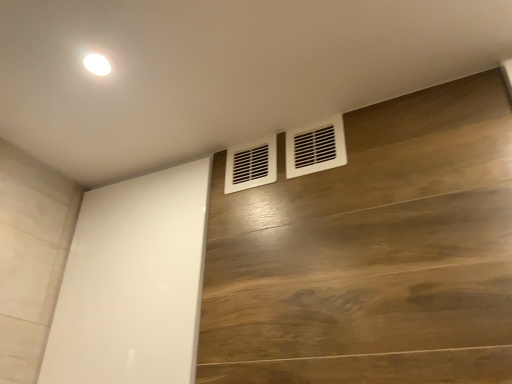
What is the approximate height of white glossy screen door at center?

white glossy screen door at center is 26.96 inches in height.

Describe the element at coordinates (251, 165) in the screenshot. This screenshot has height=384, width=512. I see `white matte vent at center, the second air conditioning viewed from the right` at that location.

Locate an element on the screen. The height and width of the screenshot is (384, 512). white glossy screen door at center is located at coordinates (133, 282).

Which object is closer to the camera, white glossy screen door at center or white plastic vent at upper right, which is counted as the second air conditioning, starting from the left?

white glossy screen door at center is more forward.

Could you measure the distance between white glossy screen door at center and white plastic vent at upper right, the first air conditioning when ordered from right to left?

The distance of white glossy screen door at center from white plastic vent at upper right, the first air conditioning when ordered from right to left, is 20.04 inches.

You are a GUI agent. You are given a task and a screenshot of the screen. Output one action in this format:
    pyautogui.click(x=<x>, y=<y>)
    Task: Click on the 1st air conditioning located above the white glossy screen door at center (from a real-world perspective)
    
    Given the screenshot: What is the action you would take?
    pyautogui.click(x=315, y=147)

Considering the sizes of objects white matte vent at center, arranged as the first air conditioning when viewed from the left, and white glossy screen door at center in the image provided, who is taller, white matte vent at center, arranged as the first air conditioning when viewed from the left, or white glossy screen door at center?

white glossy screen door at center.

How different are the orientations of white matte vent at center, arranged as the first air conditioning when viewed from the left, and white glossy screen door at center in degrees?

1.95 degrees.

Is the depth of white matte vent at center, the second air conditioning viewed from the right, less than that of white glossy screen door at center?

No, it is behind white glossy screen door at center.

Is point (338, 130) less distant than point (226, 169)?

Yes, point (338, 130) is in front of point (226, 169).

Is white plastic vent at upper right, the first air conditioning when ordered from right to left, closer to the viewer compared to white matte vent at center, the second air conditioning viewed from the right?

That is True.

Looking at their sizes, would you say white plastic vent at upper right, which is counted as the second air conditioning, starting from the left, is wider or thinner than white matte vent at center, the second air conditioning viewed from the right?

Clearly, white plastic vent at upper right, which is counted as the second air conditioning, starting from the left, has more width compared to white matte vent at center, the second air conditioning viewed from the right.

How many degrees apart are the facing directions of white plastic vent at upper right, the first air conditioning when ordered from right to left, and white matte vent at center, arranged as the first air conditioning when viewed from the left?

white plastic vent at upper right, the first air conditioning when ordered from right to left, and white matte vent at center, arranged as the first air conditioning when viewed from the left, are facing 0.00562 degrees away from each other.

Is white matte vent at center, the second air conditioning viewed from the right, outside of white plastic vent at upper right, which is counted as the second air conditioning, starting from the left?

Yes, white matte vent at center, the second air conditioning viewed from the right, is located beyond the bounds of white plastic vent at upper right, which is counted as the second air conditioning, starting from the left.

Is white matte vent at center, the second air conditioning viewed from the right, with white plastic vent at upper right, the first air conditioning when ordered from right to left?

white matte vent at center, the second air conditioning viewed from the right, and white plastic vent at upper right, the first air conditioning when ordered from right to left, are clearly separated.

Who is bigger, white matte vent at center, the second air conditioning viewed from the right, or white plastic vent at upper right, which is counted as the second air conditioning, starting from the left?

Bigger between the two is white matte vent at center, the second air conditioning viewed from the right.

Locate an element on the screen. This screenshot has width=512, height=384. air conditioning that is under the white matte vent at center, the second air conditioning viewed from the right (from a real-world perspective) is located at coordinates (315, 147).

The image size is (512, 384). Find the location of `screen door below the white matte vent at center, the second air conditioning viewed from the right (from a real-world perspective)`. screen door below the white matte vent at center, the second air conditioning viewed from the right (from a real-world perspective) is located at coordinates (133, 282).

Between white glossy screen door at center and white matte vent at center, arranged as the first air conditioning when viewed from the left, which one has larger size?

white glossy screen door at center is bigger.

Relative to white matte vent at center, arranged as the first air conditioning when viewed from the left, is white glossy screen door at center in front or behind?

In the image, white glossy screen door at center appears in front of white matte vent at center, arranged as the first air conditioning when viewed from the left.

Considering the sizes of objects white glossy screen door at center and white matte vent at center, arranged as the first air conditioning when viewed from the left, in the image provided, who is thinner, white glossy screen door at center or white matte vent at center, arranged as the first air conditioning when viewed from the left,?

Thinner between the two is white matte vent at center, arranged as the first air conditioning when viewed from the left.

Is white plastic vent at upper right, which is counted as the second air conditioning, starting from the left, not inside white glossy screen door at center?

Indeed, white plastic vent at upper right, which is counted as the second air conditioning, starting from the left, is completely outside white glossy screen door at center.

In the scene shown: Does white plastic vent at upper right, which is counted as the second air conditioning, starting from the left, have a lesser height compared to white glossy screen door at center?

Yes, white plastic vent at upper right, which is counted as the second air conditioning, starting from the left, is shorter than white glossy screen door at center.

Is white plastic vent at upper right, which is counted as the second air conditioning, starting from the left, oriented towards white glossy screen door at center?

No.

From the image's perspective, which is above, white plastic vent at upper right, which is counted as the second air conditioning, starting from the left, or white glossy screen door at center?

white plastic vent at upper right, which is counted as the second air conditioning, starting from the left, from the image's perspective.

Find the location of a particular element. The image size is (512, 384). screen door in front of the white plastic vent at upper right, which is counted as the second air conditioning, starting from the left is located at coordinates (133, 282).

Where is `screen door lying on the left of white matte vent at center, arranged as the first air conditioning when viewed from the left`? screen door lying on the left of white matte vent at center, arranged as the first air conditioning when viewed from the left is located at coordinates (133, 282).

Looking at the image, which one is located closer to white plastic vent at upper right, which is counted as the second air conditioning, starting from the left, white glossy screen door at center or white matte vent at center, arranged as the first air conditioning when viewed from the left?

white matte vent at center, arranged as the first air conditioning when viewed from the left, lies closer to white plastic vent at upper right, which is counted as the second air conditioning, starting from the left, than the other object.

Estimate the real-world distances between objects in this image. Which object is closer to white matte vent at center, the second air conditioning viewed from the right, white plastic vent at upper right, which is counted as the second air conditioning, starting from the left, or white glossy screen door at center?

white plastic vent at upper right, which is counted as the second air conditioning, starting from the left, is positioned closer to the anchor white matte vent at center, the second air conditioning viewed from the right.

Considering their positions, is white plastic vent at upper right, the first air conditioning when ordered from right to left, positioned further to white glossy screen door at center than white matte vent at center, the second air conditioning viewed from the right?

The object further to white glossy screen door at center is white plastic vent at upper right, the first air conditioning when ordered from right to left.

Which object lies further to the anchor point white plastic vent at upper right, which is counted as the second air conditioning, starting from the left, white matte vent at center, the second air conditioning viewed from the right, or white glossy screen door at center?

white glossy screen door at center is positioned further to the anchor white plastic vent at upper right, which is counted as the second air conditioning, starting from the left.

Looking at this image, based on their spatial positions, is white glossy screen door at center or white plastic vent at upper right, the first air conditioning when ordered from right to left, further from white matte vent at center, the second air conditioning viewed from the right?

Among the two, white glossy screen door at center is located further to white matte vent at center, the second air conditioning viewed from the right.

Based on their spatial positions, is white matte vent at center, the second air conditioning viewed from the right, or white plastic vent at upper right, which is counted as the second air conditioning, starting from the left, closer to white glossy screen door at center?

Based on the image, white matte vent at center, the second air conditioning viewed from the right, appears to be nearer to white glossy screen door at center.

Identify the location of air conditioning between white glossy screen door at center and white plastic vent at upper right, which is counted as the second air conditioning, starting from the left, in the horizontal direction. (251, 165).